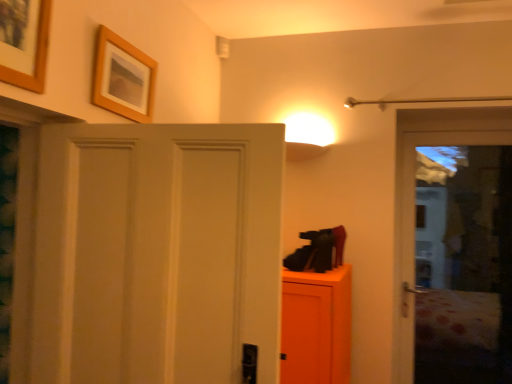
Describe the element at coordinates (24, 42) in the screenshot. I see `wooden picture frame at upper left, which is the 1th picture frame in left-to-right order` at that location.

How much space does wooden picture frame at upper left, positioned as the second picture frame in right-to-left order, occupy horizontally?

wooden picture frame at upper left, positioned as the second picture frame in right-to-left order, is 1.67 inches wide.

Find the location of `wooden picture frame at upper left, positioned as the second picture frame in right-to-left order`. wooden picture frame at upper left, positioned as the second picture frame in right-to-left order is located at coordinates (24, 42).

Describe the element at coordinates (123, 78) in the screenshot. I see `wooden frame at upper left, the 2th picture frame from the front` at that location.

Identify the location of wooden frame at upper left, which ranks as the first picture frame in back-to-front order. (123, 78).

How much space does wooden frame at upper left, arranged as the 1th picture frame when viewed from the right, occupy vertically?

wooden frame at upper left, arranged as the 1th picture frame when viewed from the right, is 11.13 inches in height.

The height and width of the screenshot is (384, 512). Find the location of `wooden picture frame at upper left, placed as the 1th picture frame when sorted from front to back`. wooden picture frame at upper left, placed as the 1th picture frame when sorted from front to back is located at coordinates (24, 42).

Which is more to the left, wooden frame at upper left, the 2th picture frame from the front, or wooden picture frame at upper left, positioned as the second picture frame in back-to-front order?

Positioned to the left is wooden picture frame at upper left, positioned as the second picture frame in back-to-front order.

In the image, is wooden frame at upper left, the 2th picture frame from the front, positioned in front of or behind wooden picture frame at upper left, which is the 1th picture frame in left-to-right order?

wooden frame at upper left, the 2th picture frame from the front, is behind wooden picture frame at upper left, which is the 1th picture frame in left-to-right order.

Considering the positions of point (126, 97) and point (12, 1), is point (126, 97) closer or farther from the camera than point (12, 1)?

Point (126, 97).

From the image's perspective, which is above, wooden frame at upper left, arranged as the 1th picture frame when viewed from the right, or wooden picture frame at upper left, positioned as the second picture frame in back-to-front order?

wooden picture frame at upper left, positioned as the second picture frame in back-to-front order, appears higher in the image.

From a real-world perspective, who is located lower, wooden frame at upper left, which ranks as the first picture frame in back-to-front order, or wooden picture frame at upper left, which is the 1th picture frame in left-to-right order?

wooden frame at upper left, which ranks as the first picture frame in back-to-front order, is physically lower.

Considering the sizes of objects wooden frame at upper left, the second picture frame positioned from the left, and wooden picture frame at upper left, which is the 1th picture frame in left-to-right order, in the image provided, who is thinner, wooden frame at upper left, the second picture frame positioned from the left, or wooden picture frame at upper left, which is the 1th picture frame in left-to-right order,?

With smaller width is wooden picture frame at upper left, which is the 1th picture frame in left-to-right order.

Is wooden frame at upper left, the 2th picture frame from the front, shorter than wooden picture frame at upper left, placed as the 1th picture frame when sorted from front to back?

Correct, wooden frame at upper left, the 2th picture frame from the front, is not as tall as wooden picture frame at upper left, placed as the 1th picture frame when sorted from front to back.

Between wooden frame at upper left, arranged as the 1th picture frame when viewed from the right, and wooden picture frame at upper left, which is the 1th picture frame in left-to-right order, which one has smaller size?

wooden frame at upper left, arranged as the 1th picture frame when viewed from the right, is smaller.

Is wooden frame at upper left, the 2th picture frame from the front, not inside wooden picture frame at upper left, positioned as the second picture frame in back-to-front order?

Absolutely, wooden frame at upper left, the 2th picture frame from the front, is external to wooden picture frame at upper left, positioned as the second picture frame in back-to-front order.

Based on the photo, is the surface of wooden frame at upper left, the 2th picture frame from the front, in direct contact with wooden picture frame at upper left, positioned as the second picture frame in back-to-front order?

No, wooden frame at upper left, the 2th picture frame from the front, is not with wooden picture frame at upper left, positioned as the second picture frame in back-to-front order.

Is wooden frame at upper left, which ranks as the first picture frame in back-to-front order, looking in the opposite direction of wooden picture frame at upper left, positioned as the second picture frame in right-to-left order?

No, wooden frame at upper left, which ranks as the first picture frame in back-to-front order, is not facing away from wooden picture frame at upper left, positioned as the second picture frame in right-to-left order.

The width and height of the screenshot is (512, 384). In order to click on picture frame behind the wooden picture frame at upper left, which is the 1th picture frame in left-to-right order in this screenshot , I will do `click(123, 78)`.

Based on their positions, is wooden picture frame at upper left, placed as the 1th picture frame when sorted from front to back, located to the left or right of wooden frame at upper left, arranged as the 1th picture frame when viewed from the right?

Clearly, wooden picture frame at upper left, placed as the 1th picture frame when sorted from front to back, is on the left of wooden frame at upper left, arranged as the 1th picture frame when viewed from the right, in the image.

Does wooden picture frame at upper left, positioned as the second picture frame in back-to-front order, lie behind wooden frame at upper left, arranged as the 1th picture frame when viewed from the right?

No, wooden picture frame at upper left, positioned as the second picture frame in back-to-front order, is in front of wooden frame at upper left, arranged as the 1th picture frame when viewed from the right.

Is point (32, 40) positioned in front of point (106, 90)?

Yes, point (32, 40) is in front of point (106, 90).

From the image's perspective, is wooden picture frame at upper left, positioned as the second picture frame in back-to-front order, above or below wooden frame at upper left, arranged as the 1th picture frame when viewed from the right?

wooden picture frame at upper left, positioned as the second picture frame in back-to-front order, is situated higher than wooden frame at upper left, arranged as the 1th picture frame when viewed from the right, in the image.

From a real-world perspective, which object rests below the other?

wooden frame at upper left, the second picture frame positioned from the left.

Does wooden picture frame at upper left, placed as the 1th picture frame when sorted from front to back, have a greater width compared to wooden frame at upper left, arranged as the 1th picture frame when viewed from the right?

No, wooden picture frame at upper left, placed as the 1th picture frame when sorted from front to back, is not wider than wooden frame at upper left, arranged as the 1th picture frame when viewed from the right.

Considering the relative sizes of wooden picture frame at upper left, which is the 1th picture frame in left-to-right order, and wooden frame at upper left, the second picture frame positioned from the left, in the image provided, is wooden picture frame at upper left, which is the 1th picture frame in left-to-right order, shorter than wooden frame at upper left, the second picture frame positioned from the left,?

No, wooden picture frame at upper left, which is the 1th picture frame in left-to-right order, is not shorter than wooden frame at upper left, the second picture frame positioned from the left.

Who is bigger, wooden picture frame at upper left, which is the 1th picture frame in left-to-right order, or wooden frame at upper left, arranged as the 1th picture frame when viewed from the right?

wooden picture frame at upper left, which is the 1th picture frame in left-to-right order.

Looking at this image, is wooden picture frame at upper left, which is the 1th picture frame in left-to-right order, outside of wooden frame at upper left, the second picture frame positioned from the left?

That's correct, wooden picture frame at upper left, which is the 1th picture frame in left-to-right order, is outside of wooden frame at upper left, the second picture frame positioned from the left.

Is wooden picture frame at upper left, placed as the 1th picture frame when sorted from front to back, far away from wooden frame at upper left, the 2th picture frame from the front?

No.

Could you tell me if wooden picture frame at upper left, positioned as the second picture frame in back-to-front order, is facing wooden frame at upper left, the 2th picture frame from the front?

No, wooden picture frame at upper left, positioned as the second picture frame in back-to-front order, is not facing towards wooden frame at upper left, the 2th picture frame from the front.

How distant is wooden picture frame at upper left, positioned as the second picture frame in right-to-left order, from wooden frame at upper left, which ranks as the first picture frame in back-to-front order?

14.67 inches.

At what (x,y) coordinates should I click in order to perform the action: click on picture frame lying on the left of wooden frame at upper left, the second picture frame positioned from the left. Please return your answer as a coordinate pair (x, y). Looking at the image, I should click on (24, 42).

The height and width of the screenshot is (384, 512). In order to click on picture frame above the wooden frame at upper left, arranged as the 1th picture frame when viewed from the right (from a real-world perspective) in this screenshot , I will do `click(24, 42)`.

Find the location of a particular element. The height and width of the screenshot is (384, 512). picture frame in front of the wooden frame at upper left, arranged as the 1th picture frame when viewed from the right is located at coordinates (24, 42).